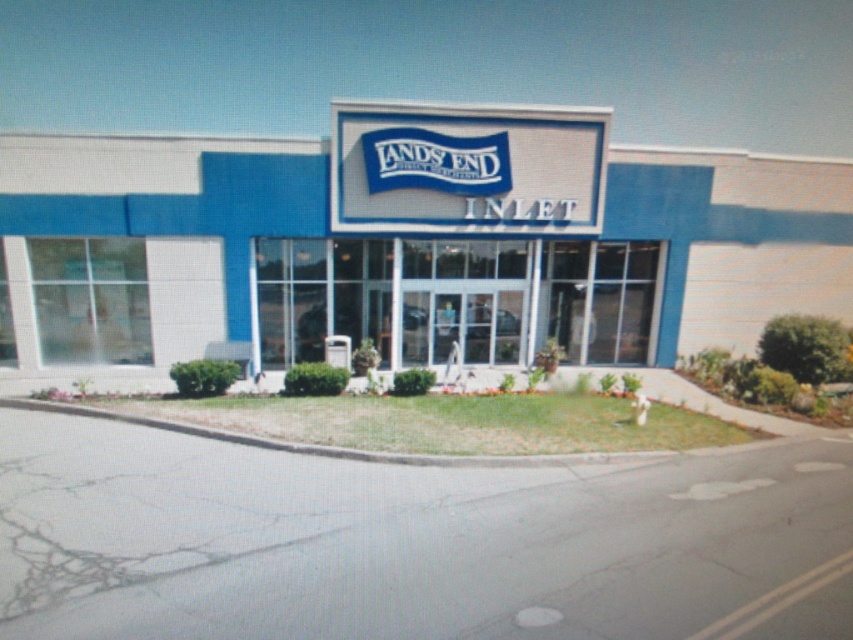
Is white textured building at center behind transparent glass storefront at center?

That is False.

The height and width of the screenshot is (640, 853). I want to click on white textured building at center, so click(x=408, y=243).

At what (x,y) coordinates should I click in order to perform the action: click on white textured building at center. Please return your answer as a coordinate pair (x, y). This screenshot has height=640, width=853. Looking at the image, I should click on 408,243.

Where is `white textured building at center`? white textured building at center is located at coordinates (408, 243).